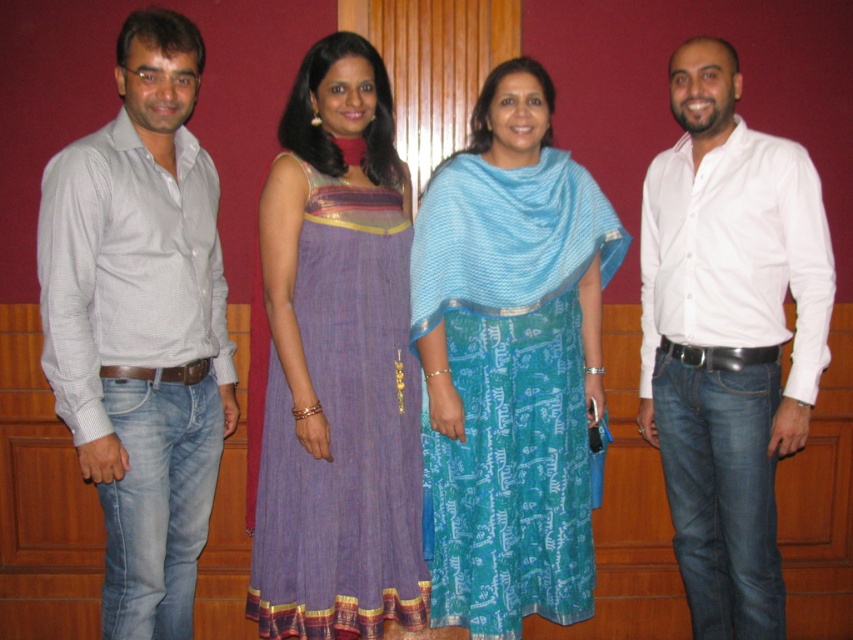
Does point (141, 342) lie in front of point (347, 188)?

Yes, it is in front of point (347, 188).

The width and height of the screenshot is (853, 640). Identify the location of light gray shirt at left. (141, 324).

Is point (184, 32) farther from viewer compared to point (299, 436)?

No, it is not.

Locate an element on the screen. light gray shirt at left is located at coordinates (141, 324).

Can you confirm if light gray shirt at left is positioned below white cotton shirt at right?

Actually, light gray shirt at left is above white cotton shirt at right.

Identify the location of light gray shirt at left. (141, 324).

Does purple cotton dress at center appear under blue silk shawl at center?

Yes.

Is purple cotton dress at center wider than blue silk shawl at center?

No.

Is point (258, 621) more distant than point (579, 230)?

That is False.

Find the location of `purple cotton dress at center`. purple cotton dress at center is located at coordinates (341, 429).